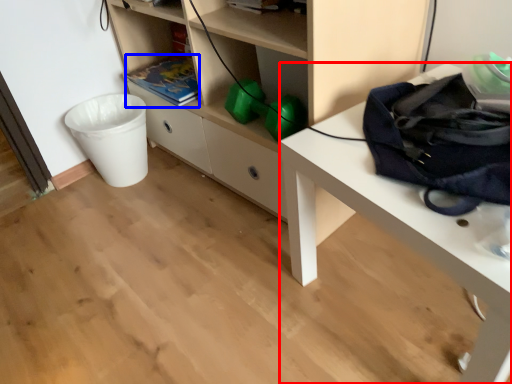
Question: Among these objects, which one is nearest to the camera, desk (highlighted by a red box) or book (highlighted by a blue box)?

Choices:
 (A) desk
 (B) book

Answer: (A)